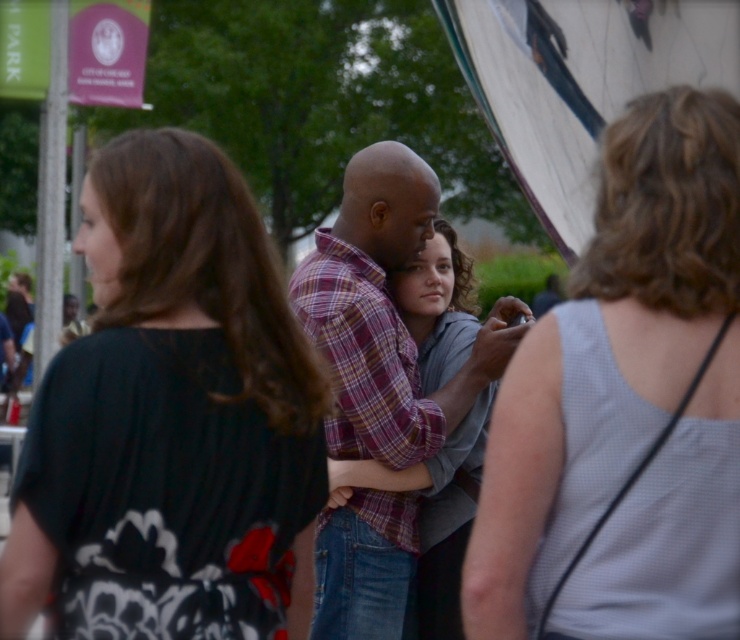
Does gray dotted tank top at right appear under plaid cotton shirt at center?

Yes, gray dotted tank top at right is below plaid cotton shirt at center.

Looking at this image, between gray dotted tank top at right and plaid cotton shirt at center, which one is positioned lower?

gray dotted tank top at right is lower down.

Who is more distant from viewer, (629, 365) or (377, 300)?

The point (377, 300) is more distant.

This screenshot has width=740, height=640. Find the location of `gray dotted tank top at right`. gray dotted tank top at right is located at coordinates (625, 404).

Who is lower down, black matte dress at center or plaid shirt at center?

Positioned lower is black matte dress at center.

Is the position of black matte dress at center less distant than that of plaid shirt at center?

Yes, black matte dress at center is in front of plaid shirt at center.

Is point (132, 392) farther from viewer compared to point (353, 272)?

No, it is in front of (353, 272).

In order to click on black matte dress at center in this screenshot , I will do `click(169, 416)`.

Which is more to the left, gray dotted tank top at right or plaid shirt at center?

From the viewer's perspective, plaid shirt at center appears more on the left side.

At what (x,y) coordinates should I click in order to perform the action: click on gray dotted tank top at right. Please return your answer as a coordinate pair (x, y). This screenshot has width=740, height=640. Looking at the image, I should click on (625, 404).